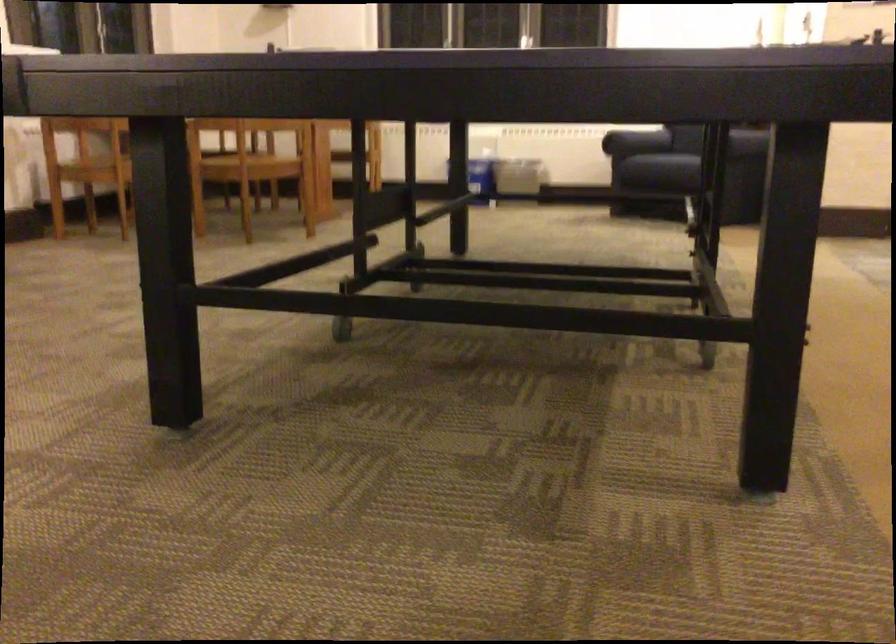
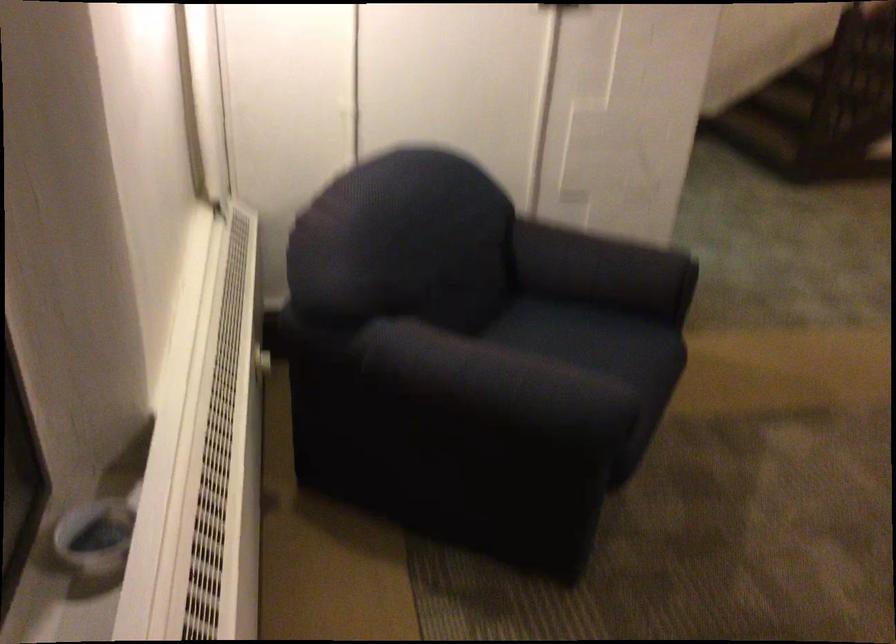
Question: I am providing you with two images of the same scene from different viewpoints. Which of the following objects are not visible in image2?

Choices:
 (A) wall safe handle
 (B) white radiator dial
 (C) dark blue armrest
 (D) sofa armrest

Answer: (D)